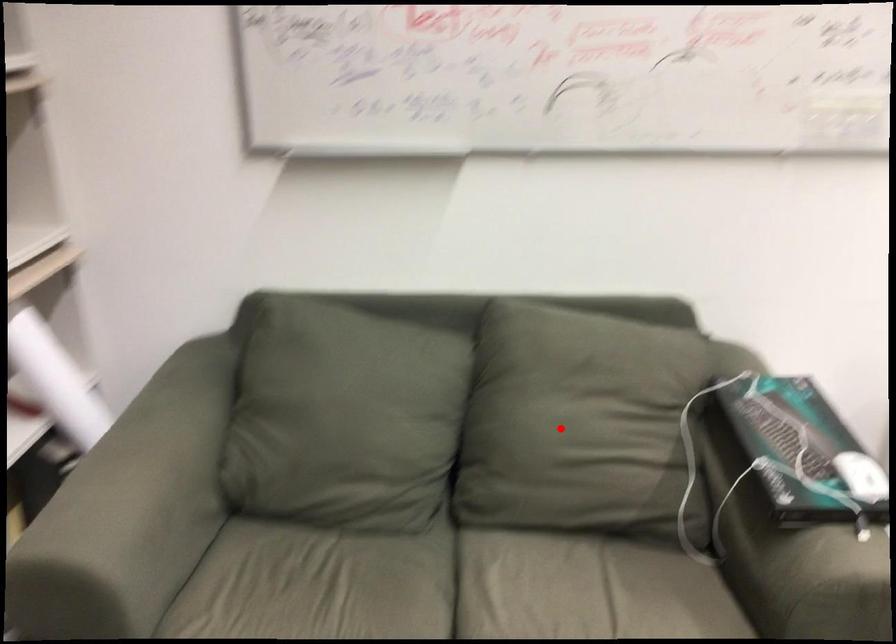
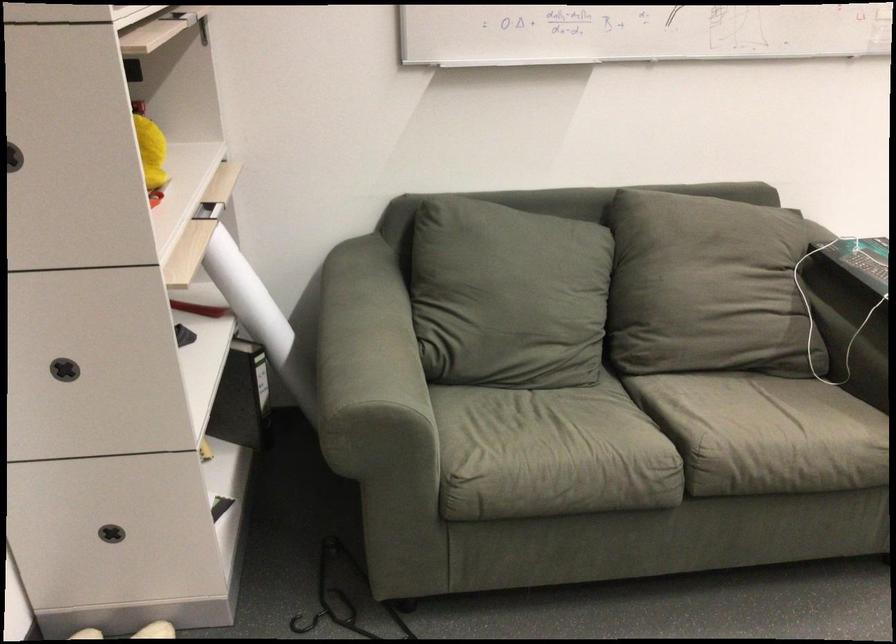
Find the pixel in the second image that matches the highlighted location in the first image.

(707, 287)